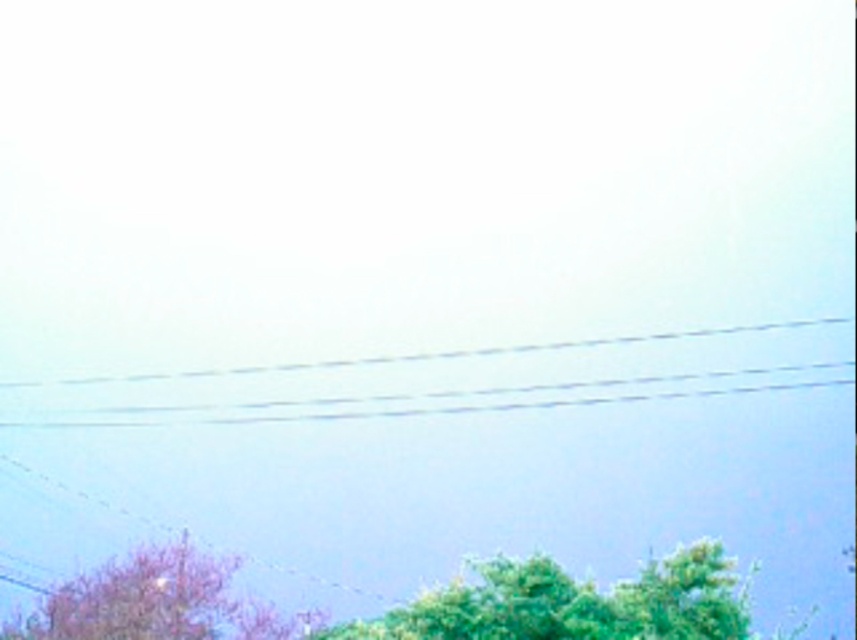
Question: Which point is farther from the camera taking this photo?

Choices:
 (A) (271, 616)
 (B) (453, 621)
 (C) (628, 371)

Answer: (C)

Question: Which object is closer to the camera taking this photo?

Choices:
 (A) green leafy tree at lower center
 (B) clear plastic power lines at center

Answer: (A)

Question: Which point is closer to the camera?

Choices:
 (A) green leafy tree at lower center
 (B) clear plastic power lines at center

Answer: (A)

Question: Is clear plastic power lines at center to the right of green leafy tree at lower center from the viewer's perspective?

Choices:
 (A) yes
 (B) no

Answer: (B)

Question: Is green leafy tree at lower center below pink matte tree at lower left?

Choices:
 (A) yes
 (B) no

Answer: (B)

Question: Is green leafy tree at lower center to the right of pink matte tree at lower left from the viewer's perspective?

Choices:
 (A) yes
 (B) no

Answer: (A)